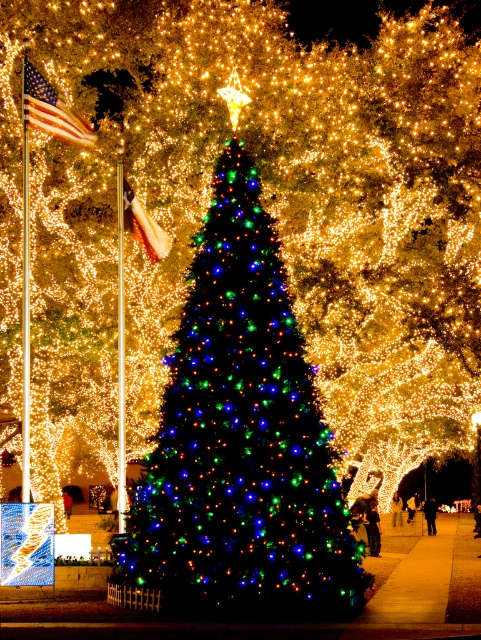
Question: Does silky white flag at center appear on the right side of dark blue jeans at center?

Choices:
 (A) yes
 (B) no

Answer: (B)

Question: Does black leather jacket at center lie in front of dark blue jeans at center?

Choices:
 (A) no
 (B) yes

Answer: (B)

Question: Does black leather jacket at center come behind yellow fabric bag at center?

Choices:
 (A) yes
 (B) no

Answer: (B)

Question: Which object is closer to the camera taking this photo?

Choices:
 (A) dark brown leather jacket at center
 (B) dark blue jeans at center
 (C) american flag at upper left
 (D) multicolored lights christmas tree at center

Answer: (D)

Question: Which point appears farthest from the camera in this image?

Choices:
 (A) (434, 518)
 (B) (129, 212)
 (C) (189, 396)

Answer: (A)

Question: Which point is farther to the camera?

Choices:
 (A) multicolored lights christmas tree at center
 (B) yellow fabric bag at center
 (C) american flag at upper left

Answer: (B)